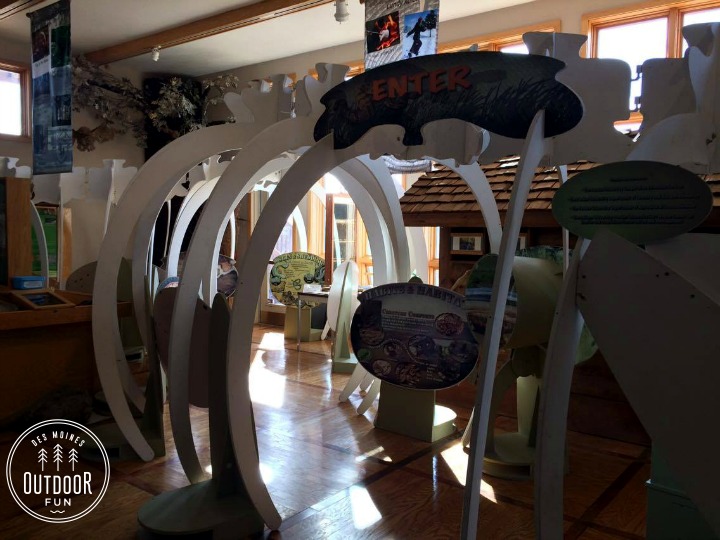
The image size is (720, 540). Find the location of `window`. window is located at coordinates (11, 108).